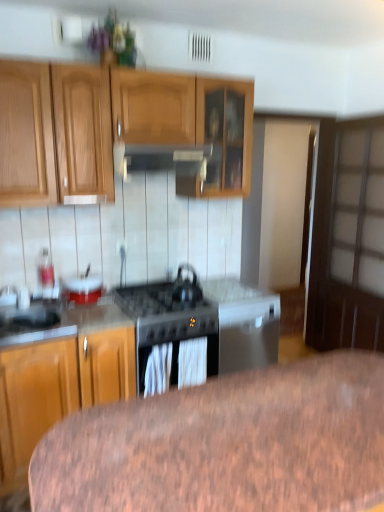
Locate an element on the screen. vacant space positioned to the left of black matte kettle at center is located at coordinates (158, 301).